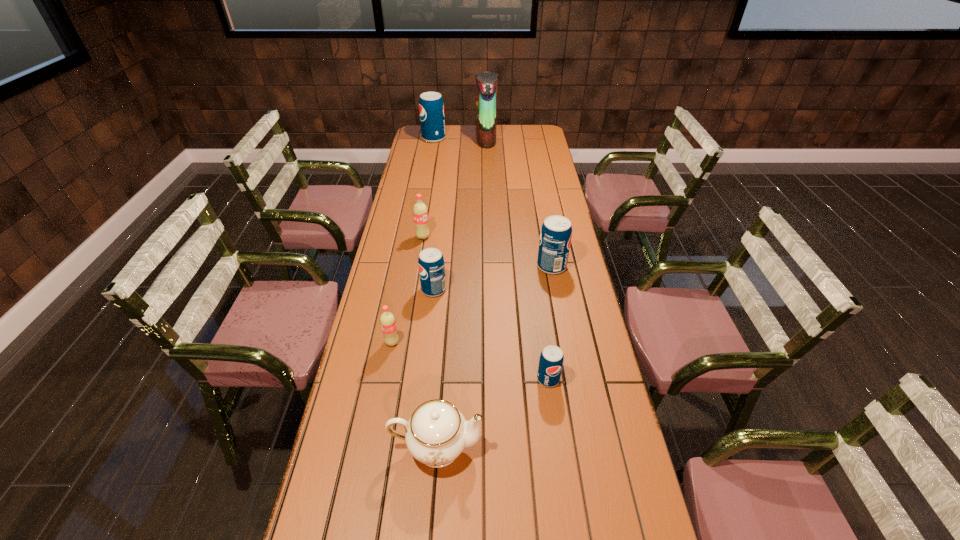
Where is `the fifth closest pop to the smaller red soda`? the fifth closest pop to the smaller red soda is located at coordinates (431, 107).

Identify the location of pop that stands as the fifth closest to the nearer red soda. (431, 107).

Choose which blue pop is the nearest neighbor to the tallest object. Please provide its 2D coordinates. Your answer should be formatted as a tuple, i.e. [(x, y)], where the tuple contains the x and y coordinates of a point satisfying the conditions above.

[(431, 107)]

The height and width of the screenshot is (540, 960). What are the coordinates of `the second closest blue pop to the fifth farthest pop` in the screenshot? It's located at (551, 360).

Locate which red soda ranks in proximity to the nearest pop. Please provide its 2D coordinates. Your answer should be formatted as a tuple, i.e. [(x, y)], where the tuple contains the x and y coordinates of a point satisfying the conditions above.

[(387, 320)]

Locate which red soda is the second closest to the fourth farthest pop. Please provide its 2D coordinates. Your answer should be formatted as a tuple, i.e. [(x, y)], where the tuple contains the x and y coordinates of a point satisfying the conditions above.

[(420, 212)]